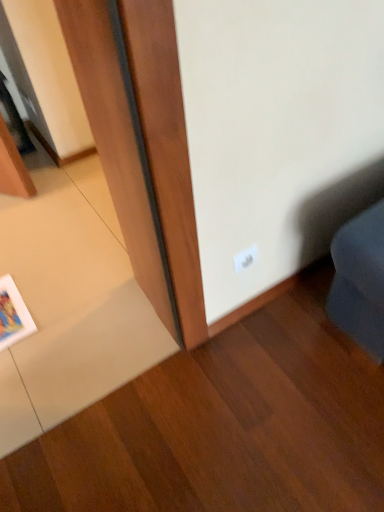
In order to click on white plastic electric outlet at lower right in this screenshot , I will do `click(245, 258)`.

Describe the element at coordinates (245, 258) in the screenshot. I see `white plastic electric outlet at lower right` at that location.

At what (x,y) coordinates should I click in order to perform the action: click on white plastic electric outlet at lower right. Please return your answer as a coordinate pair (x, y). Looking at the image, I should click on (245, 258).